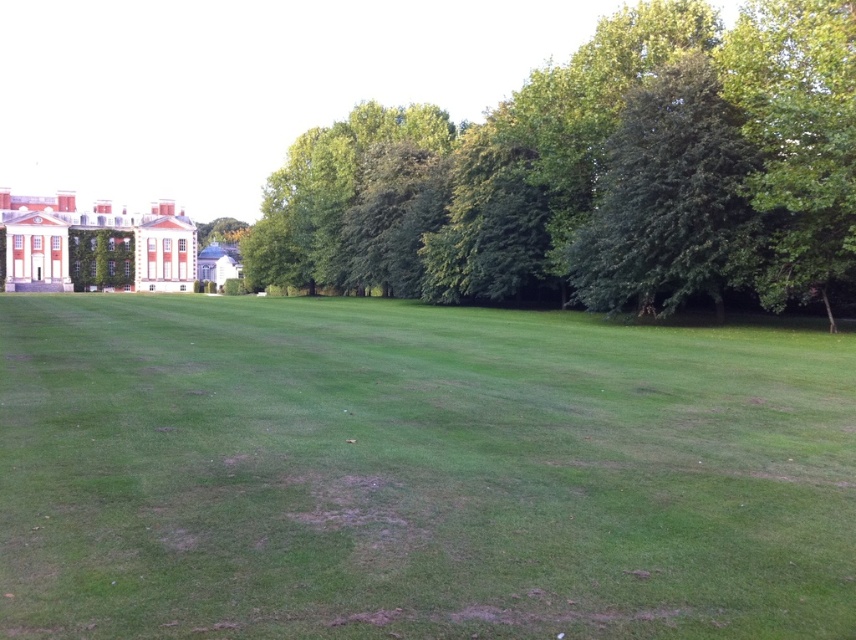
You are standing at the center of the grassy area and want to walk to both the point at coordinates [389,488] and the point at coordinates [575,200]. Which point will you reach first?

You will reach point [389,488] first because it is closer to the camera than point [575,200].